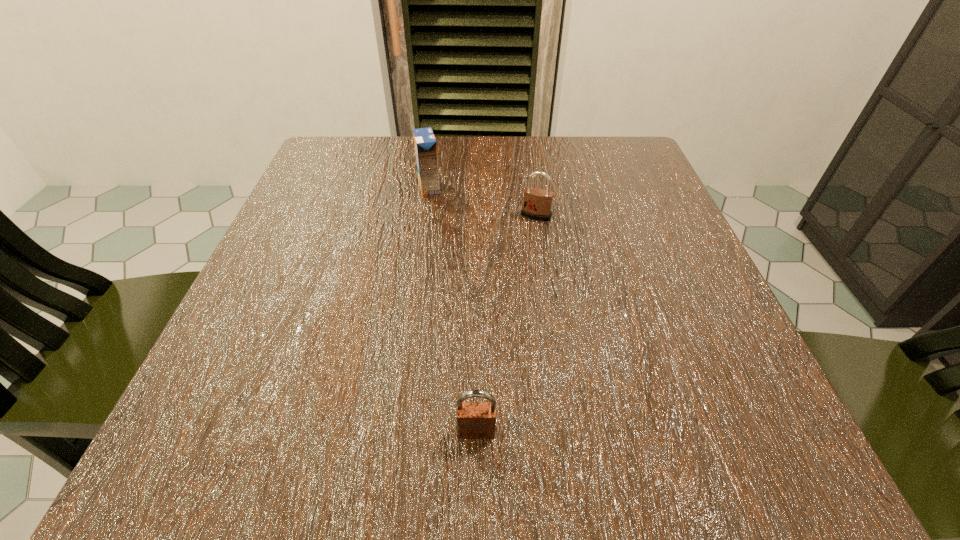
At what (x,y) coordinates should I click in order to perform the action: click on free spot between the nearest object and the leftmost object. Please return your answer as a coordinate pair (x, y). Looking at the image, I should click on (453, 309).

The image size is (960, 540). I want to click on vacant space that is in between the leftmost object and the rightmost object, so click(x=483, y=201).

Identify the location of free spot between the right padlock and the tallest object. (483, 201).

Find the location of a particular element. Image resolution: width=960 pixels, height=540 pixels. empty space between the second object from right to left and the orange_juice is located at coordinates (453, 309).

This screenshot has width=960, height=540. Identify the location of free space between the tallest object and the left padlock. (x=453, y=309).

Image resolution: width=960 pixels, height=540 pixels. What are the coordinates of `unoccupied area between the second object from left to right and the right padlock` in the screenshot? It's located at (506, 323).

Find the location of a particular element. The height and width of the screenshot is (540, 960). free space between the right padlock and the orange_juice is located at coordinates (483, 201).

The width and height of the screenshot is (960, 540). In order to click on free spot between the nearest object and the leftmost object in this screenshot , I will do coord(453,309).

Where is `vacant area that lies between the second object from left to right and the farther padlock`? The height and width of the screenshot is (540, 960). vacant area that lies between the second object from left to right and the farther padlock is located at coordinates (506, 323).

Locate which object is the closest to the tallest object. Please provide its 2D coordinates. Your answer should be formatted as a tuple, i.e. [(x, y)], where the tuple contains the x and y coordinates of a point satisfying the conditions above.

[(537, 202)]